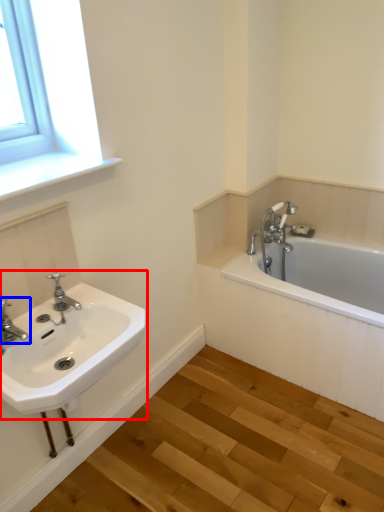
Question: Which of the following is the farthest to the observer, sink (highlighted by a red box) or tap (highlighted by a blue box)?

Choices:
 (A) sink
 (B) tap

Answer: (B)